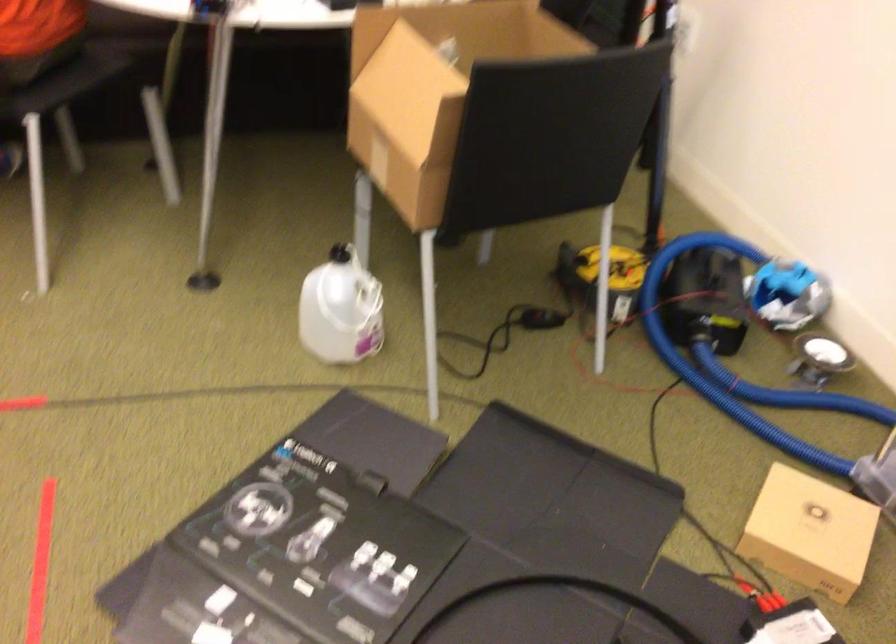
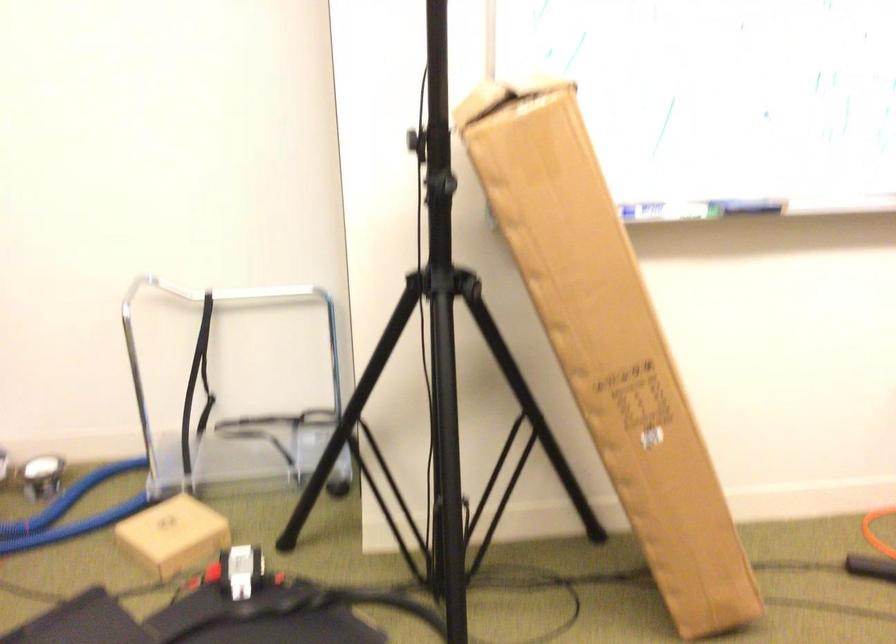
Locate, in the second image, the point that corresponds to [797,401] in the first image.

(67, 498)